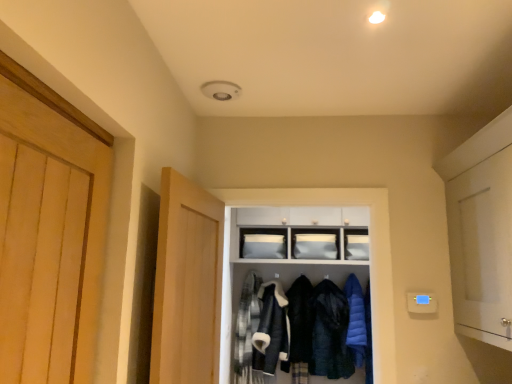
Question: Is plaid fabric shirt at center, the 5th clothing when ordered from right to left, bigger or smaller than dark blue wool coat at center, the 3th clothing in the right-to-left sequence?

Choices:
 (A) small
 (B) big

Answer: (A)

Question: From the image's perspective, is plaid fabric shirt at center, the 1th clothing viewed from the left, above or below dark blue wool coat at center, which is the third clothing from left to right?

Choices:
 (A) below
 (B) above

Answer: (B)

Question: Estimate the real-world distances between objects in this image. Which object is closer to the dark blue wool coat at center, the 3th clothing in the right-to-left sequence?

Choices:
 (A) light wood door at center, marked as the 1th door in a left-to-right arrangement
 (B) white matte cabinet at center, arranged as the first cabinetry when ordered from the bottom
 (C) dark blue quilted jacket at center, which ranks as the 2th clothing in right-to-left order
 (D) plaid fabric shirt at center, the 1th clothing viewed from the left
 (E) white matte cabinet at right, which is the first door in right-to-left order

Answer: (C)

Question: Considering the real-world distances, which object is farthest from the plaid fabric shirt at center, the 5th clothing when ordered from right to left?

Choices:
 (A) blue down jacket at center, which is the 1th clothing from right to left
 (B) white fur-lined jacket at center, arranged as the 2th clothing when viewed from the left
 (C) white matte cabinet at center, arranged as the first cabinetry when ordered from the bottom
 (D) matte white cabinet at center, the 2th cabinetry in the bottom-to-top sequence
 (E) dark blue quilted jacket at center, which ranks as the 4th clothing in left-to-right order

Answer: (A)